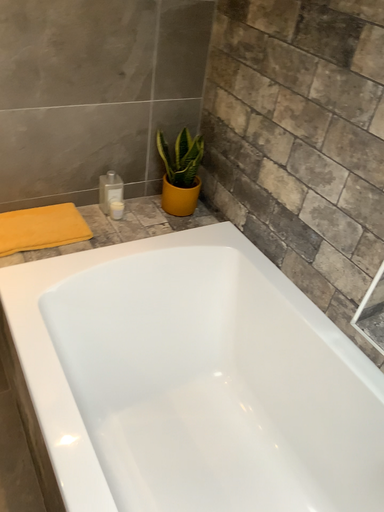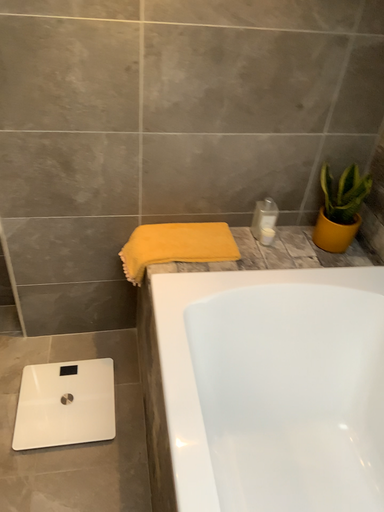
Question: How did the camera likely rotate when shooting the video?

Choices:
 (A) rotated right
 (B) rotated left

Answer: (B)